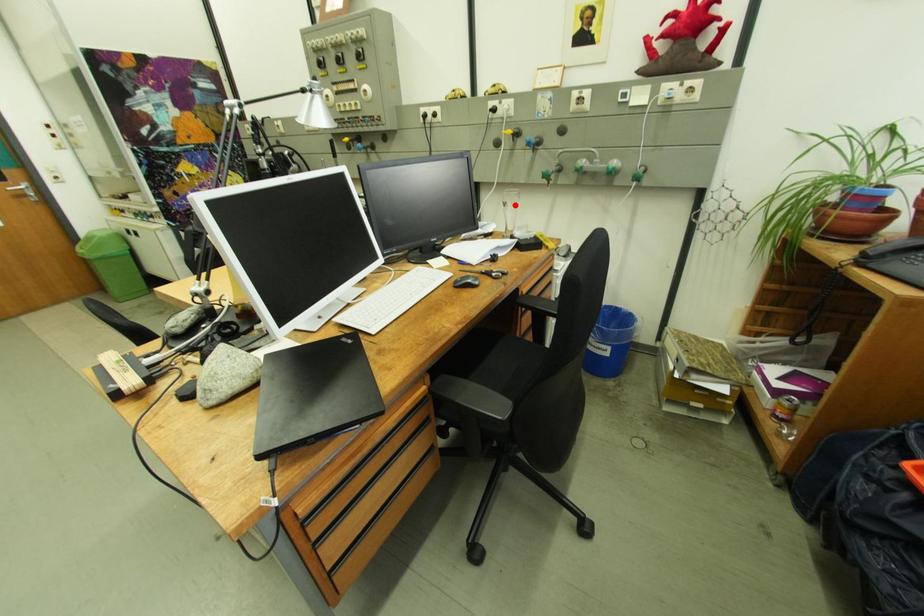
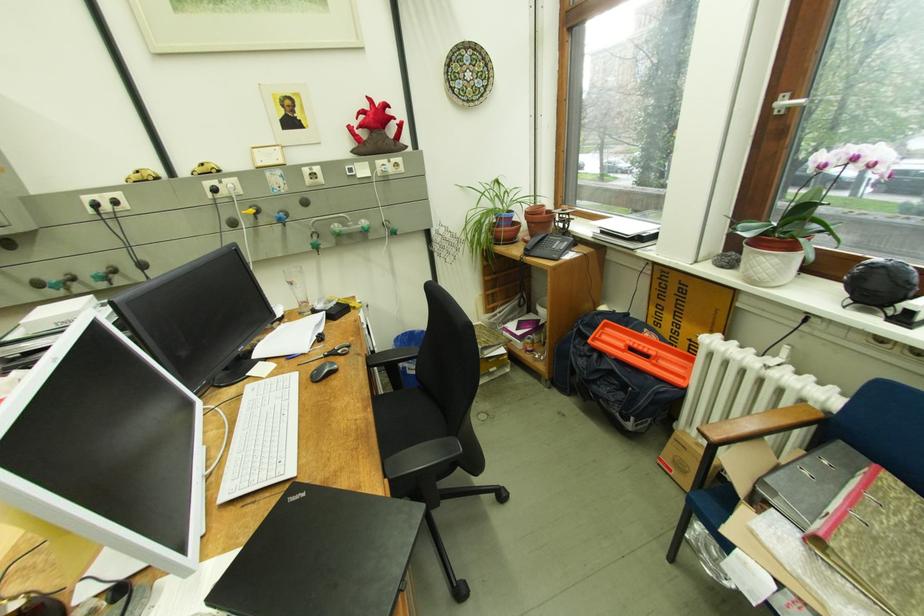
The point at the highlighted location is marked in the first image. Where is the corresponding point in the second image?

(301, 284)